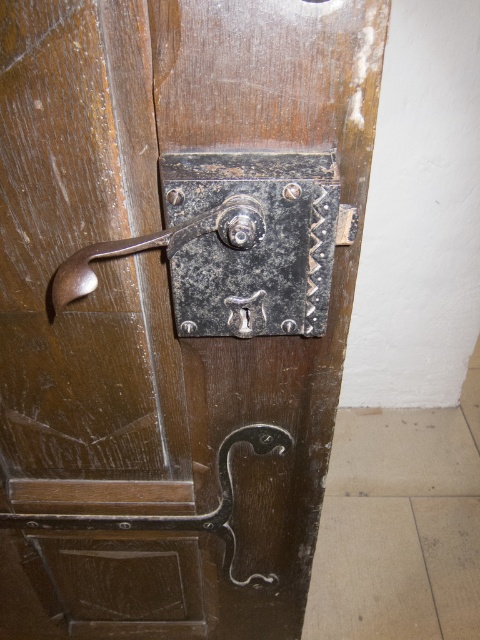
From the picture: Is polished dark brown metal hook at lower center above polished brass lever at center?

No.

Is point (261, 577) farther from viewer compared to point (256, 209)?

Yes, point (261, 577) is farther from viewer.

Is point (278, 429) farther from camera compared to point (251, 234)?

Yes, point (278, 429) is behind point (251, 234).

In order to click on polished dark brown metal hook at lower center in this screenshot , I will do `click(177, 515)`.